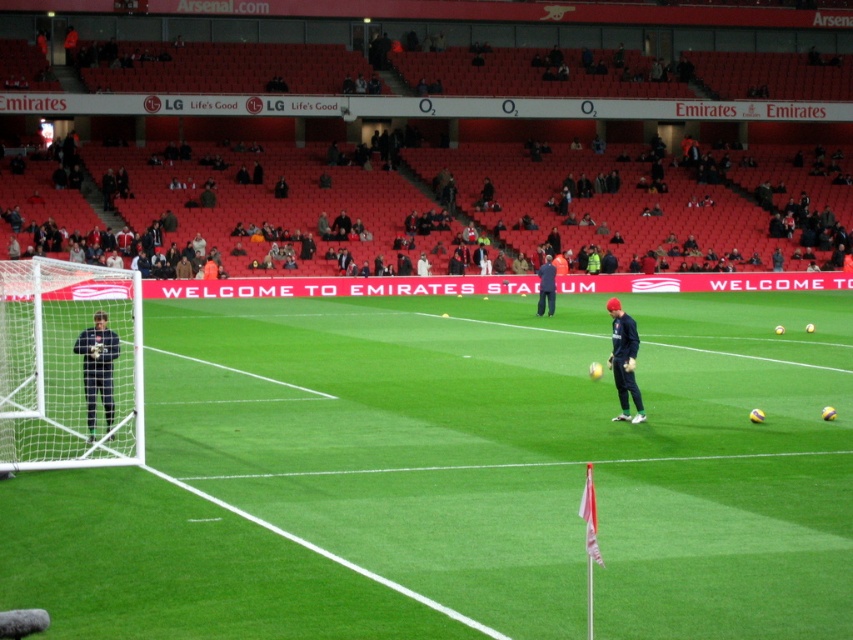
Between point (471, 214) and point (91, 424), which one is positioned in front?

Point (91, 424) is more forward.

Does dark blue tracksuit at center appear over dark blue jersey at left?

Yes, dark blue tracksuit at center is above dark blue jersey at left.

Who is more forward, (363, 240) or (102, 326)?

Point (102, 326) is more forward.

Find the location of `dark blue tracksuit at center`. dark blue tracksuit at center is located at coordinates (492, 198).

Can you confirm if dark blue jersey at left is bigger than dark blue uniform at center?

No, dark blue jersey at left is not bigger than dark blue uniform at center.

What do you see at coordinates (97, 368) in the screenshot?
I see `dark blue jersey at left` at bounding box center [97, 368].

This screenshot has height=640, width=853. Describe the element at coordinates (97, 368) in the screenshot. I see `dark blue jersey at left` at that location.

The image size is (853, 640). What are the coordinates of `dark blue jersey at left` in the screenshot? It's located at coord(97,368).

Is dark blue tracksuit at center behind dark blue jersey at center?

Yes, dark blue tracksuit at center is behind dark blue jersey at center.

How much distance is there between dark blue tracksuit at center and dark blue jersey at center?

The distance of dark blue tracksuit at center from dark blue jersey at center is 102.54 feet.

Between point (178, 152) and point (614, 305), which one is positioned in front?

Point (614, 305)

Where is `dark blue tracksuit at center`? This screenshot has height=640, width=853. dark blue tracksuit at center is located at coordinates (492, 198).